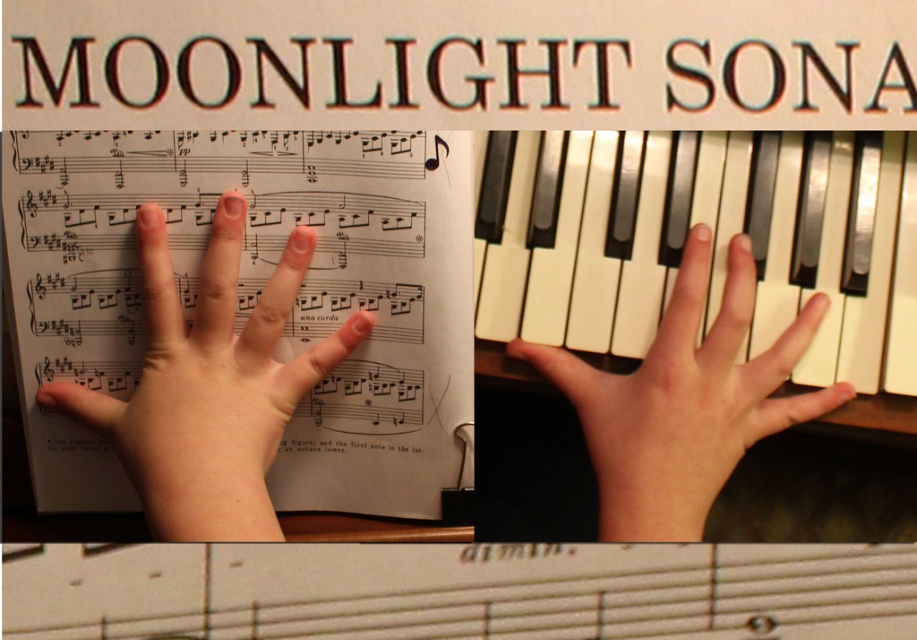
Does pale skin hand at upper left have a larger size compared to smooth skin hand at upper center?

No, pale skin hand at upper left is not bigger than smooth skin hand at upper center.

Which is behind, point (114, 404) or point (586, 387)?

Positioned behind is point (586, 387).

Does point (286, 305) lie in front of point (612, 428)?

No, it is not.

Where is `pale skin hand at upper left`? The width and height of the screenshot is (917, 640). pale skin hand at upper left is located at coordinates (208, 385).

Which of these two, white glossy piano keys at center or pale skin hand at upper left, stands shorter?

Standing shorter between the two is pale skin hand at upper left.

Can you confirm if white glossy piano keys at center is wider than pale skin hand at upper left?

Indeed, white glossy piano keys at center has a greater width compared to pale skin hand at upper left.

Is point (854, 134) positioned behind point (197, 397)?

Yes, point (854, 134) is farther from viewer.

This screenshot has height=640, width=917. I want to click on white glossy piano keys at center, so click(x=671, y=250).

Is white glossy piano keys at center smaller than smooth skin hand at upper center?

Yes.

Which is in front, point (849, 362) or point (710, 360)?

Point (710, 360) is more forward.

The height and width of the screenshot is (640, 917). What are the coordinates of `white glossy piano keys at center` in the screenshot? It's located at pos(671,250).